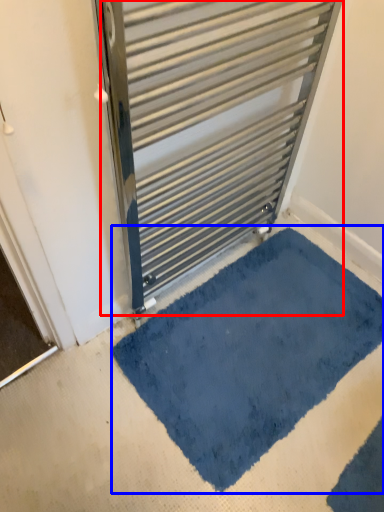
Question: Which of the following is the closest to the observer, radiator (highlighted by a red box) or bath mat (highlighted by a blue box)?

Choices:
 (A) radiator
 (B) bath mat

Answer: (A)